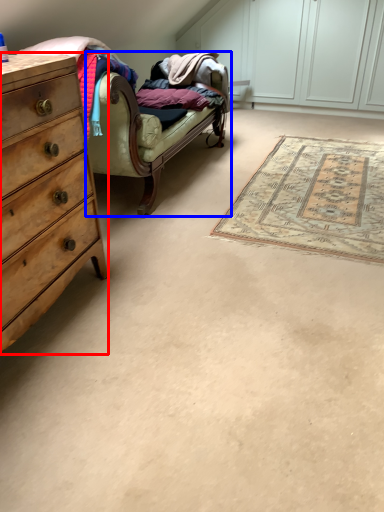
Question: Which object is closer to the camera taking this photo, chest of drawers (highlighted by a red box) or studio couch (highlighted by a blue box)?

Choices:
 (A) chest of drawers
 (B) studio couch

Answer: (A)